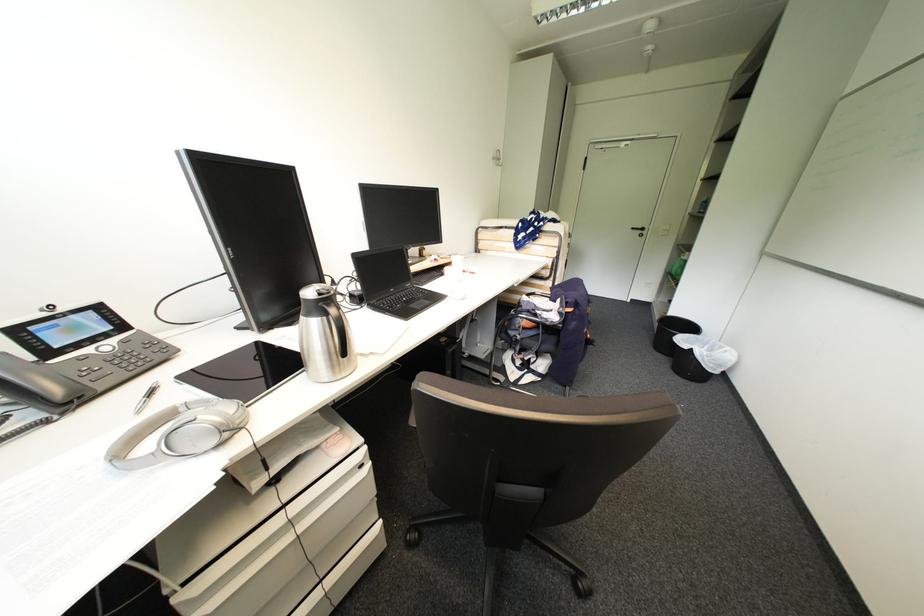
The width and height of the screenshot is (924, 616). Find the location of `silver pen`. silver pen is located at coordinates (146, 398).